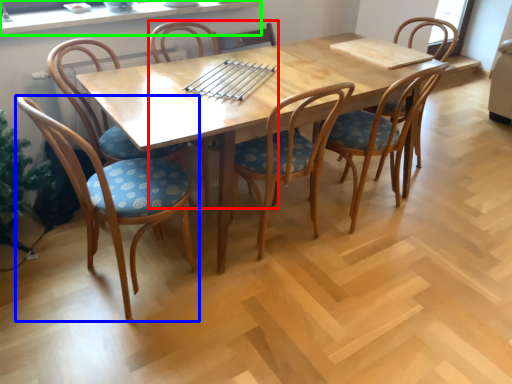
Question: Considering the real-world distances, which object is farthest from chair (highlighted by a red box)? chair (highlighted by a blue box) or window sill (highlighted by a green box)?

Choices:
 (A) chair
 (B) window sill

Answer: (A)